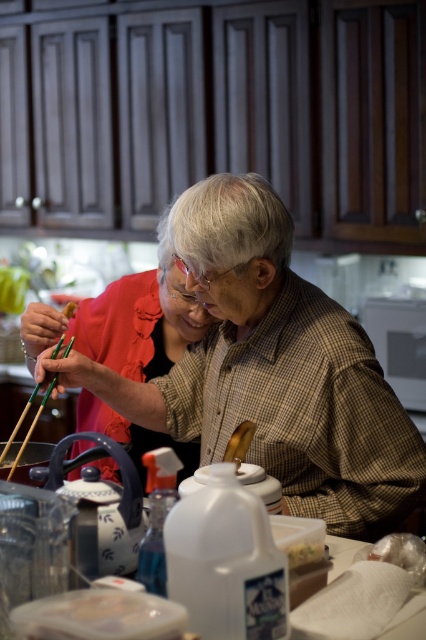
Question: Among these points, which one is farthest from the camera?

Choices:
 (A) (160, 308)
 (B) (72, 301)

Answer: (A)

Question: Does green bamboo chopsticks at left have a lesser width compared to white crumbly food at center?

Choices:
 (A) yes
 (B) no

Answer: (B)

Question: Can you confirm if matte black shirt at center is positioned to the right of brown crumbly bread at upper left?

Choices:
 (A) yes
 (B) no

Answer: (A)

Question: Where is matte brown shirt at center located in relation to white crumbly food at center in the image?

Choices:
 (A) above
 (B) below

Answer: (A)

Question: Which object is positioned closest to the brown crumbly bread at upper left?

Choices:
 (A) green bamboo chopsticks at left
 (B) matte brown shirt at center

Answer: (A)

Question: Which object appears closest to the camera in this image?

Choices:
 (A) matte black shirt at center
 (B) brown crumbly bread at upper left
 (C) matte brown shirt at center

Answer: (C)